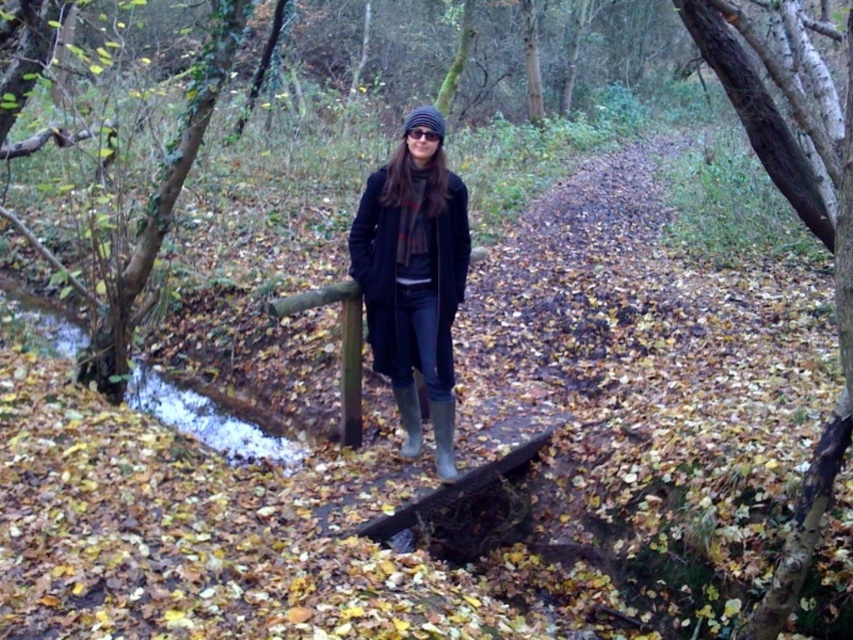
Does point (416, 209) lie in front of point (445, 477)?

Yes, point (416, 209) is in front of point (445, 477).

Does point (437, 417) come farther from viewer compared to point (444, 449)?

No.

Does point (363, 196) lie behind point (434, 416)?

No, (363, 196) is closer to viewer.

This screenshot has height=640, width=853. I want to click on matte black coat at center, so click(415, 275).

Between matte black coat at center and rubber boots at center, which one is positioned lower?

Positioned lower is rubber boots at center.

This screenshot has width=853, height=640. I want to click on matte black coat at center, so click(x=415, y=275).

Locate an element on the screen. Image resolution: width=853 pixels, height=640 pixels. matte black coat at center is located at coordinates (415, 275).

From the picture: Can you confirm if matte black coat at center is positioned below clear water at lower left?

Incorrect, matte black coat at center is not positioned below clear water at lower left.

Which is more to the left, matte black coat at center or clear water at lower left?

From the viewer's perspective, clear water at lower left appears more on the left side.

Does point (405, 397) come in front of point (148, 369)?

Yes.

Find the location of `matte black coat at center`. matte black coat at center is located at coordinates (415, 275).